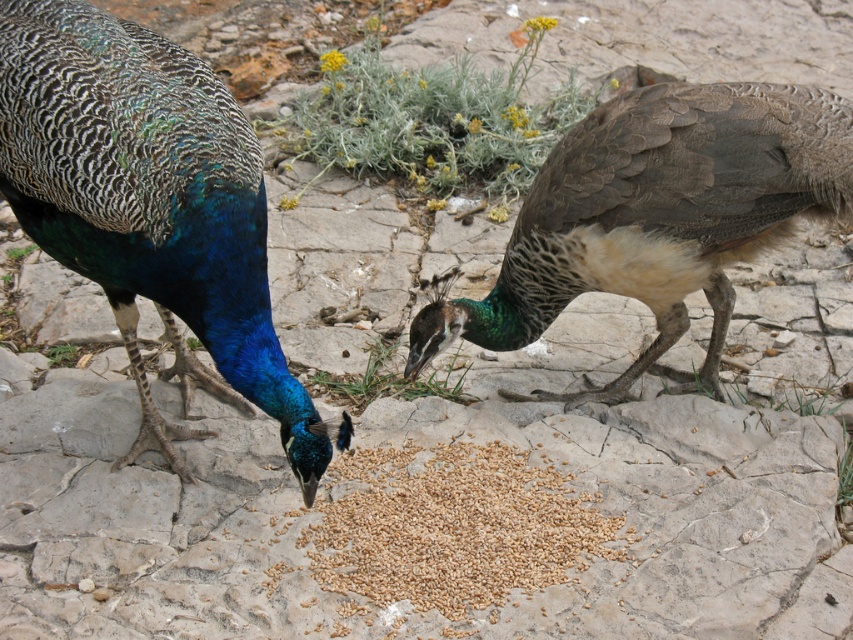
Question: Estimate the real-world distances between objects in this image. Which object is farther from the shiny blue peacock at left?

Choices:
 (A) brown textured peacock at right
 (B) brown matte grain at center

Answer: (A)

Question: Observing the image, what is the correct spatial positioning of shiny blue peacock at left in reference to brown textured peacock at right?

Choices:
 (A) left
 (B) right

Answer: (A)

Question: Can you confirm if shiny blue peacock at left is positioned below brown matte grain at center?

Choices:
 (A) no
 (B) yes

Answer: (A)

Question: Which point appears closest to the camera in this image?

Choices:
 (A) (216, 77)
 (B) (839, 157)

Answer: (A)

Question: Which point is closer to the camera?

Choices:
 (A) shiny blue peacock at left
 (B) brown matte grain at center

Answer: (A)

Question: Considering the relative positions of brown textured peacock at right and brown matte grain at center in the image provided, where is brown textured peacock at right located with respect to brown matte grain at center?

Choices:
 (A) left
 (B) right

Answer: (B)